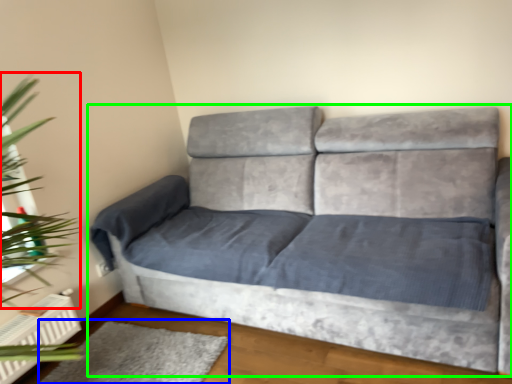
Question: Estimate the real-world distances between objects in this image. Which object is farther from plant (highlighted by a red box), mat (highlighted by a blue box) or studio couch (highlighted by a green box)?

Choices:
 (A) mat
 (B) studio couch

Answer: (B)